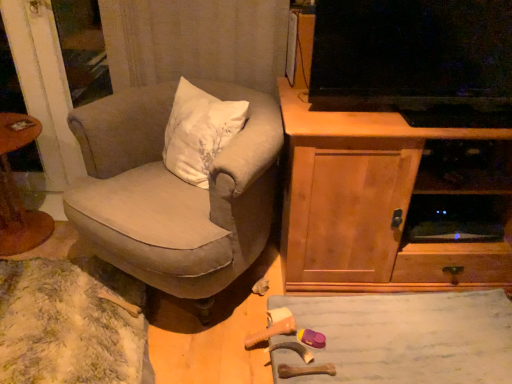
Question: Should I look upward or downward to see beige fabric chair at center?

Choices:
 (A) up
 (B) down

Answer: (A)

Question: From the image's perspective, would you say beige fabric chair at center is positioned over wooden cabinet at right?

Choices:
 (A) yes
 (B) no

Answer: (A)

Question: From the image's perspective, is beige fabric chair at center under wooden cabinet at right?

Choices:
 (A) no
 (B) yes

Answer: (A)

Question: Is wooden cabinet at right surrounded by beige fabric chair at center?

Choices:
 (A) yes
 (B) no

Answer: (B)

Question: Considering the relative sizes of beige fabric chair at center and wooden cabinet at right in the image provided, is beige fabric chair at center bigger than wooden cabinet at right?

Choices:
 (A) yes
 (B) no

Answer: (B)

Question: Is beige fabric chair at center behind wooden cabinet at right?

Choices:
 (A) no
 (B) yes

Answer: (A)

Question: Is there a large distance between beige fabric chair at center and wooden cabinet at right?

Choices:
 (A) no
 (B) yes

Answer: (A)

Question: From a real-world perspective, is wooden toy at lower center over beige fabric chair at center?

Choices:
 (A) yes
 (B) no

Answer: (B)

Question: Considering the relative sizes of wooden toy at lower center and beige fabric chair at center in the image provided, is wooden toy at lower center taller than beige fabric chair at center?

Choices:
 (A) yes
 (B) no

Answer: (B)

Question: Are wooden toy at lower center and beige fabric chair at center making contact?

Choices:
 (A) yes
 (B) no

Answer: (B)

Question: Could beige fabric chair at center be considered to be inside wooden toy at lower center?

Choices:
 (A) no
 (B) yes

Answer: (A)

Question: Are wooden toy at lower center and beige fabric chair at center far apart?

Choices:
 (A) no
 (B) yes

Answer: (A)

Question: Is wooden toy at lower center closer to camera compared to beige fabric chair at center?

Choices:
 (A) no
 (B) yes

Answer: (A)

Question: Can you confirm if wooden round table at left is wider than wooden cabinet at right?

Choices:
 (A) no
 (B) yes

Answer: (A)